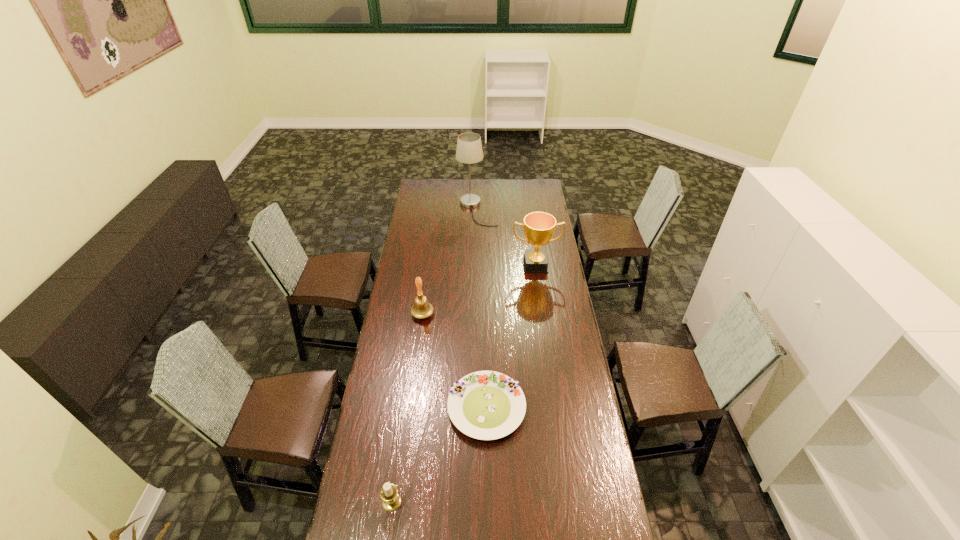
Identify the location of table lamp. Image resolution: width=960 pixels, height=540 pixels. (469, 150).

Find the location of `the tallest object`. the tallest object is located at coordinates pos(469,150).

The height and width of the screenshot is (540, 960). I want to click on award, so click(539, 227).

Identify the location of the second farthest object. click(539, 227).

This screenshot has width=960, height=540. What are the coordinates of `bell` in the screenshot? It's located at (421, 309).

Image resolution: width=960 pixels, height=540 pixels. I want to click on the third tallest object, so click(421, 309).

At what (x,y) coordinates should I click in order to perform the action: click on candle holder. Please return your answer as a coordinate pair (x, y). Looking at the image, I should click on (x=389, y=494).

Locate an element on the screen. the second shortest object is located at coordinates pos(389,494).

Where is `salad plate`? This screenshot has height=540, width=960. salad plate is located at coordinates (486, 405).

What are the coordinates of `the shortest object` in the screenshot? It's located at (486, 405).